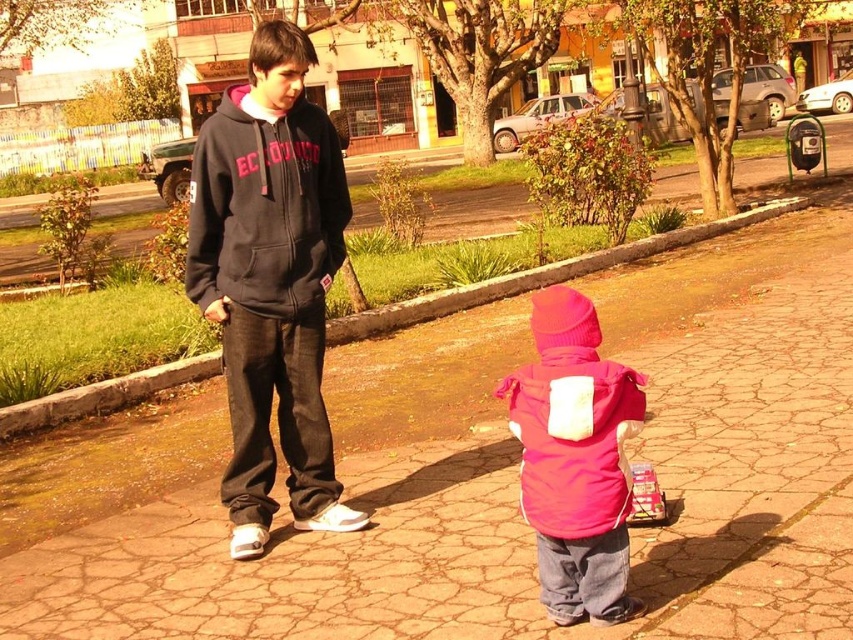
Which of these two, brown stone pavement at center or matte black hoodie at center, stands shorter?

brown stone pavement at center

Does point (734, 557) come closer to viewer compared to point (250, 502)?

Yes, it is in front of point (250, 502).

Who is more distant from viewer, (38, 568) or (193, 163)?

Positioned behind is point (193, 163).

Image resolution: width=853 pixels, height=640 pixels. Find the location of `brown stone pavement at center`. brown stone pavement at center is located at coordinates [489, 474].

Where is `matte black hoodie at center`? The height and width of the screenshot is (640, 853). matte black hoodie at center is located at coordinates (271, 282).

Who is more forward, (315, 442) or (578, 403)?

Point (578, 403)

In order to click on matte black hoodie at center in this screenshot , I will do `click(271, 282)`.

The image size is (853, 640). Identify the location of matte black hoodie at center. (271, 282).

Measure the distance between matte black hoodie at center and dark gray fleece hoodie at center.

They are 7.33 inches apart.

Which is above, matte black hoodie at center or dark gray fleece hoodie at center?

Positioned higher is dark gray fleece hoodie at center.

Is point (260, 280) positioned behind point (257, 234)?

Yes.

Where is `matte black hoodie at center`? This screenshot has height=640, width=853. matte black hoodie at center is located at coordinates (271, 282).